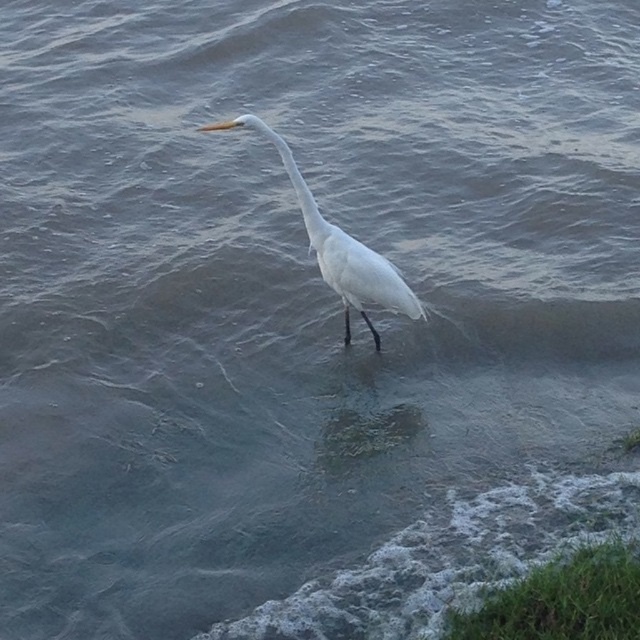
You are a wildlife photographer aiming to capture the white matte bird at center and the white smooth neck at center in a single frame. Given that your camera can only focus on one object at a time, which object should you prioritize focusing on to ensure it appears sharp and clear in the photo?

The white matte bird at center should be prioritized for focus since it has a larger size compared to the white smooth neck at center, making it the primary subject in the frame.

Based on the photo, you are a photographer aiming to capture the white matte bird at center and the white smooth neck at center in a single shot. Based on their positions, which object should appear higher in the photo?

The white smooth neck at center appears higher in the photo because the white matte bird at center is located below it.